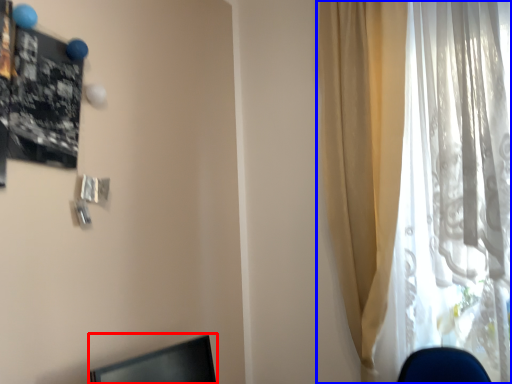
Question: Which of the following is the closest to the observer, desktop (highlighted by a red box) or curtain (highlighted by a blue box)?

Choices:
 (A) desktop
 (B) curtain

Answer: (A)